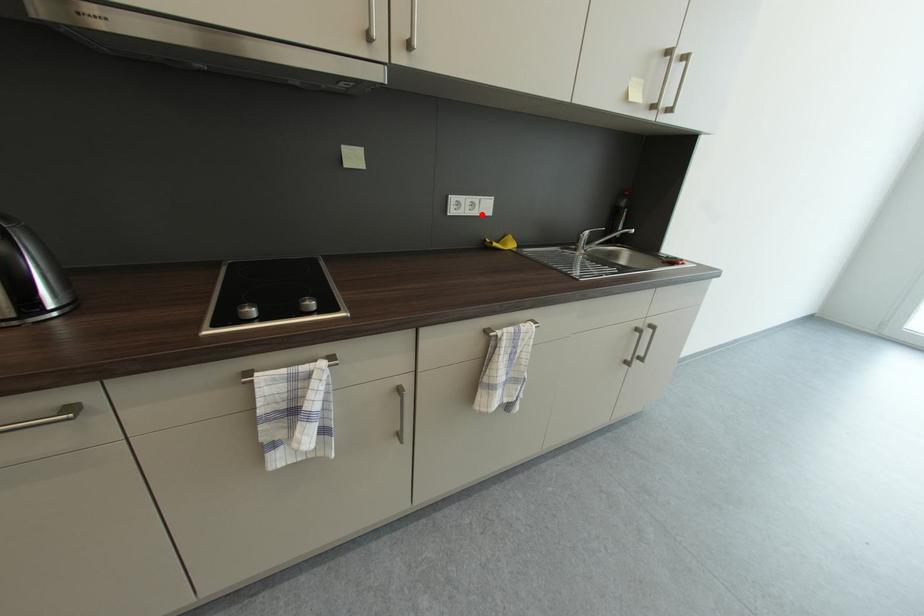
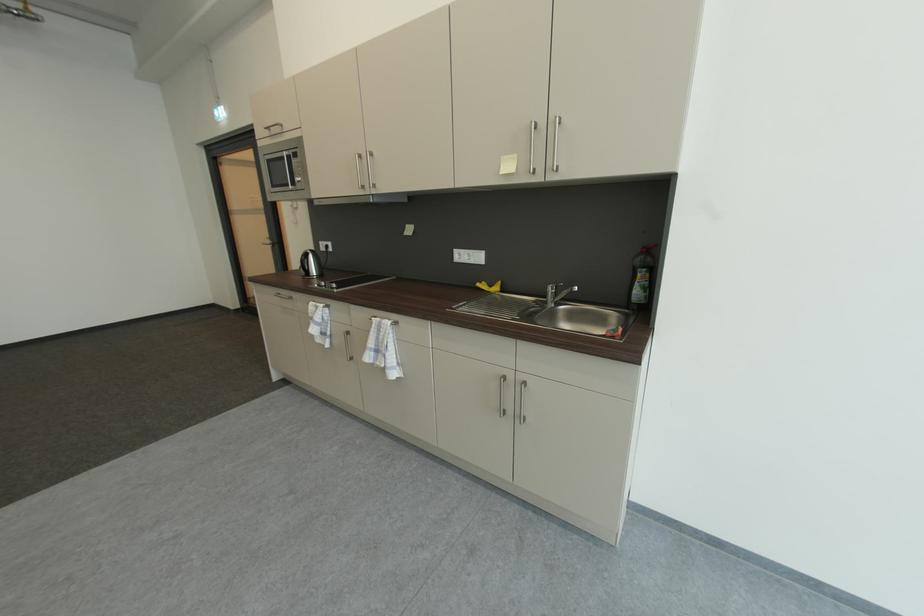
Find the pixel in the second image that matches the highlighted location in the first image.

(479, 262)